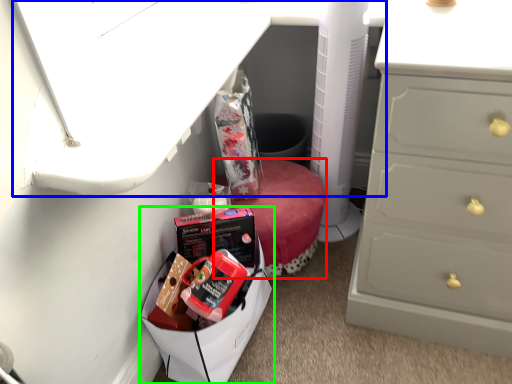
Question: Considering the real-world distances, which object is farthest from furniture (highlighted by a red box)? vanity (highlighted by a blue box) or lunch box (highlighted by a green box)?

Choices:
 (A) vanity
 (B) lunch box

Answer: (A)